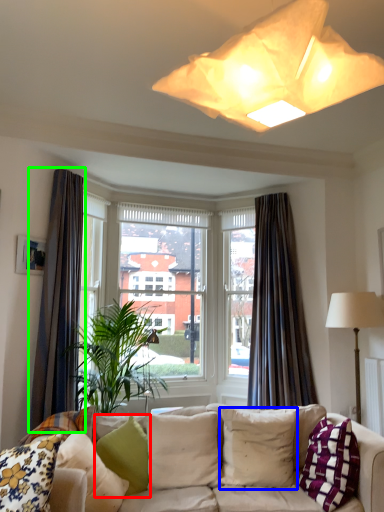
Question: Which object is the farthest from pillow (highlighted by a red box)? Choose among these: pillow (highlighted by a blue box) or curtain (highlighted by a green box).

Choices:
 (A) pillow
 (B) curtain

Answer: (B)